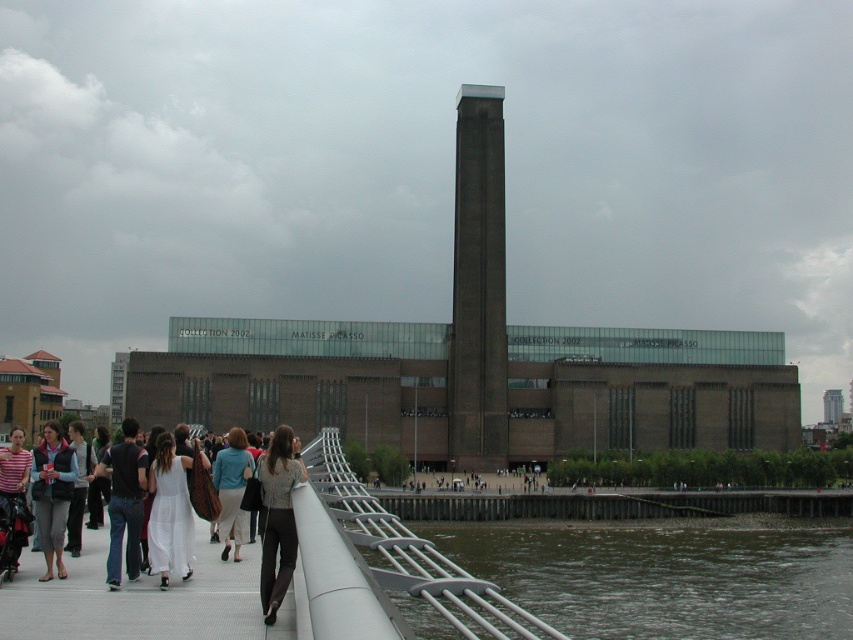
Is matte black vest at lower left above striped cotton shirt at lower left?

Actually, matte black vest at lower left is below striped cotton shirt at lower left.

Can you confirm if matte black vest at lower left is wider than striped cotton shirt at lower left?

Yes, matte black vest at lower left is wider than striped cotton shirt at lower left.

The width and height of the screenshot is (853, 640). Identify the location of matte black vest at lower left. (51, 493).

Locate an element on the screen. matte black vest at lower left is located at coordinates (51, 493).

Is dark brown water at lower center taller than white mesh bridge at lower left?

Yes, dark brown water at lower center is taller than white mesh bridge at lower left.

Looking at this image, is dark brown water at lower center above white mesh bridge at lower left?

No, dark brown water at lower center is not above white mesh bridge at lower left.

Is point (634, 618) more distant than point (99, 596)?

Yes, it is behind point (99, 596).

This screenshot has height=640, width=853. Identify the location of dark brown water at lower center. (665, 573).

Does dark blue jeans at left have a larger size compared to light brown fabric dress at center?

No.

What do you see at coordinates (125, 500) in the screenshot? I see `dark blue jeans at left` at bounding box center [125, 500].

You are a GUI agent. You are given a task and a screenshot of the screen. Output one action in this format:
    pyautogui.click(x=<x>, y=<y>)
    Task: Click on the dark blue jeans at left
    
    Given the screenshot: What is the action you would take?
    pyautogui.click(x=125, y=500)